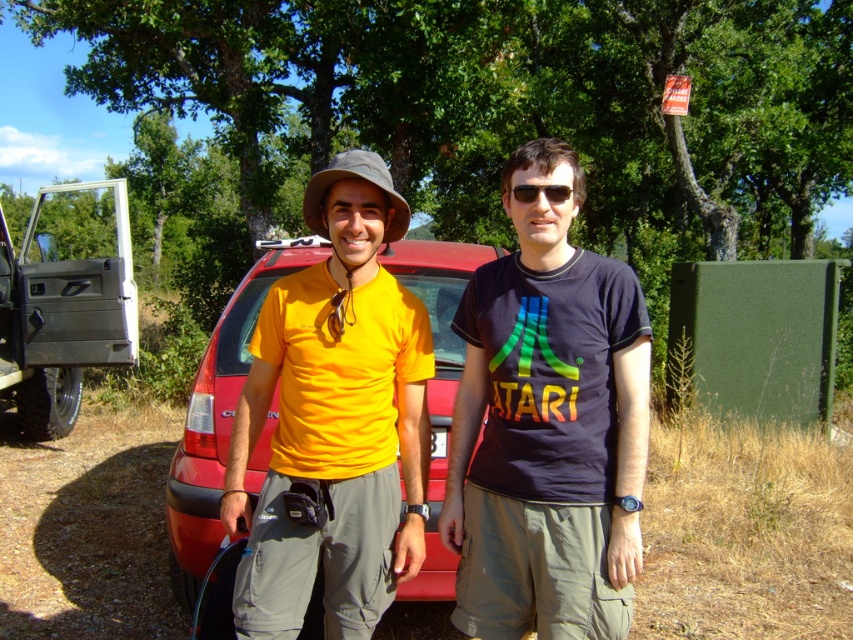
Question: Which point is farther from the camera taking this photo?

Choices:
 (A) (555, 189)
 (B) (196, 573)

Answer: (B)

Question: Does dark blue t-shirt at center have a larger size compared to black plastic sunglasses at center?

Choices:
 (A) yes
 (B) no

Answer: (A)

Question: Is dark blue t-shirt at center smaller than black plastic sunglasses at center?

Choices:
 (A) no
 (B) yes

Answer: (A)

Question: Can you confirm if metallic gray pickup truck at left is positioned below black plastic sunglasses at center?

Choices:
 (A) yes
 (B) no

Answer: (B)

Question: Which is nearer to the dark blue t-shirt at center?

Choices:
 (A) matte red car at center
 (B) black plastic sunglasses at center

Answer: (B)

Question: Which point is farther from the camera taking this photo?

Choices:
 (A) (184, 568)
 (B) (51, 296)
 (C) (514, 188)
 (D) (515, 452)

Answer: (B)